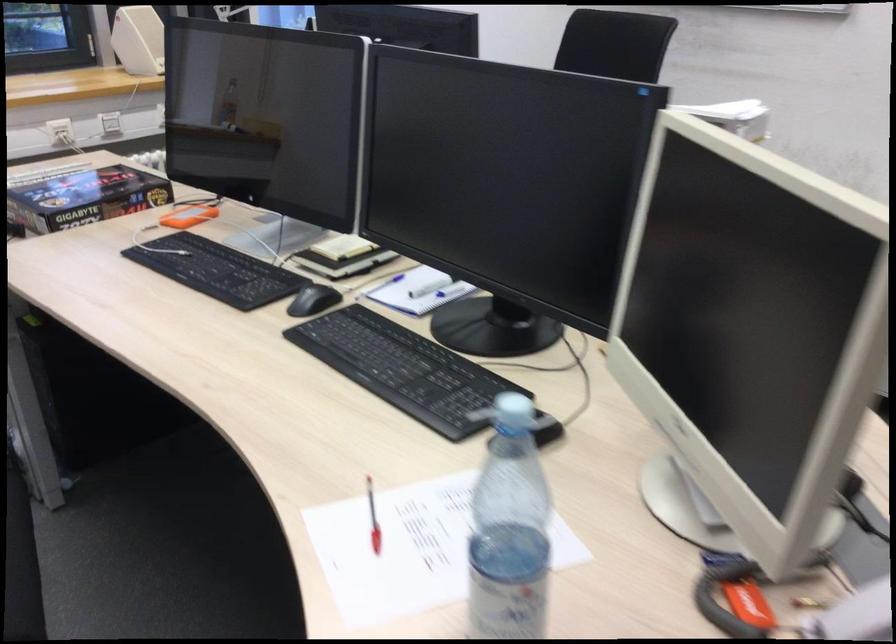
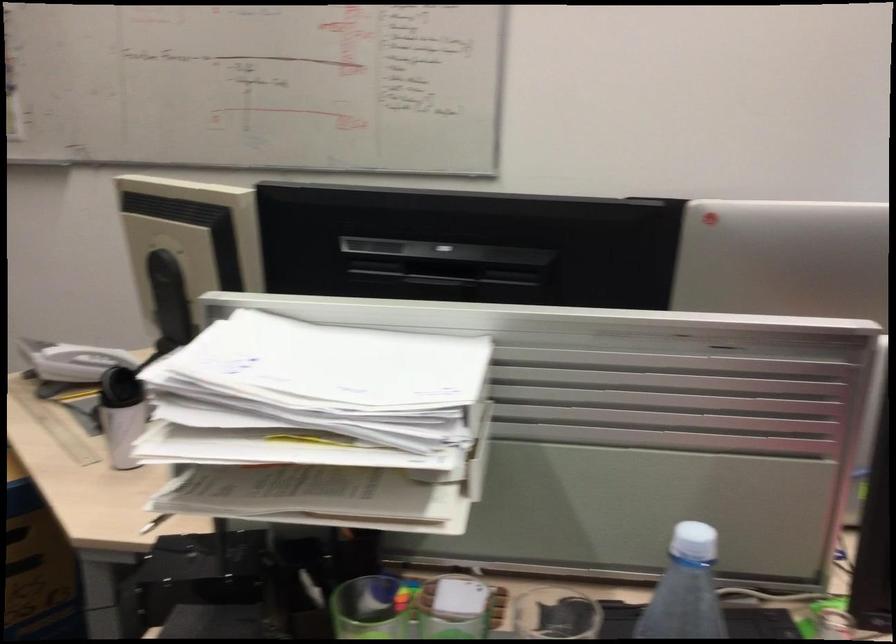
Question: I am providing you with two images of the same scene from different viewpoints. Which of the following objects are not visible in image2?

Choices:
 (A) plastic shopping bag
 (B) white smartphone
 (C) red and white pen
 (D) white bottle cap

Answer: (C)